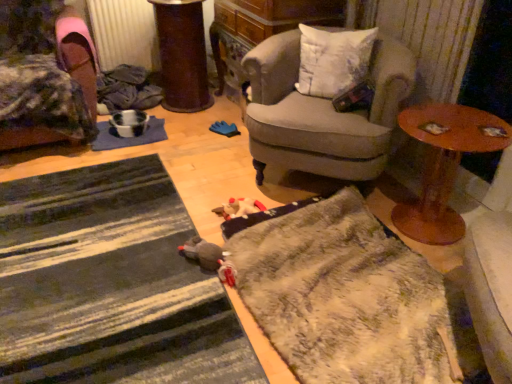
The image size is (512, 384). In order to click on vacant region below wooden round table at right (from a real-world perspective) in this screenshot , I will do `click(431, 232)`.